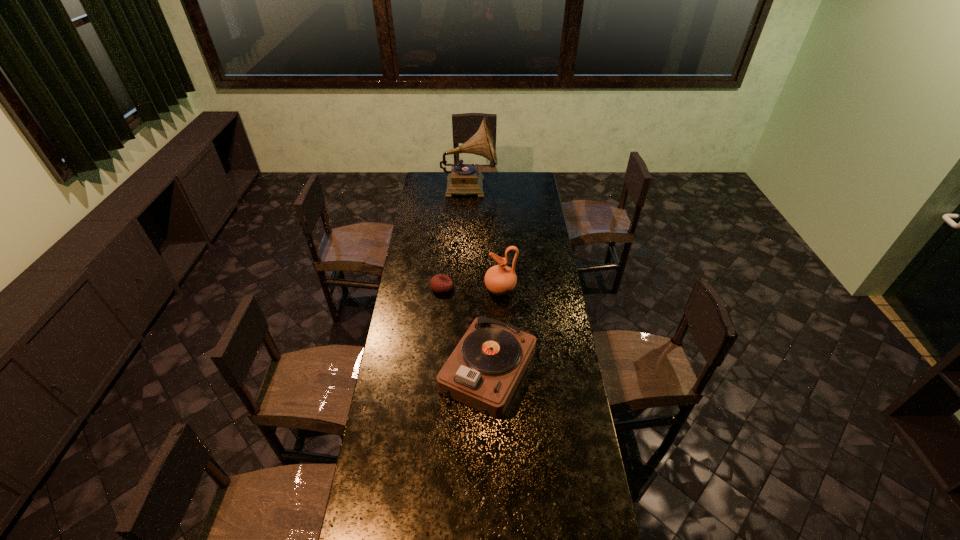
Locate an element on the screen. The image size is (960, 540). vacant space at the far left corner is located at coordinates (438, 173).

Locate an element on the screen. This screenshot has height=540, width=960. vacant region at the far right corner of the desktop is located at coordinates [x=538, y=180].

You are a GUI agent. You are given a task and a screenshot of the screen. Output one action in this format:
    pyautogui.click(x=<x>, y=<y>)
    Task: Click on the empty location between the farthest object and the shorter record player
    The height and width of the screenshot is (540, 960).
    Given the screenshot: What is the action you would take?
    pyautogui.click(x=479, y=279)

This screenshot has width=960, height=540. I want to click on blank region between the taller record player and the beanbag, so click(455, 237).

Locate an element on the screen. This screenshot has width=960, height=540. unoccupied area between the second tallest object and the farthest object is located at coordinates (485, 238).

Identify the location of blank region between the third tallest object and the tallest object. This screenshot has width=960, height=540. (479, 279).

Select which object appears as the second closest to the third tallest object. Please provide its 2D coordinates. Your answer should be formatted as a tuple, i.e. [(x, y)], where the tuple contains the x and y coordinates of a point satisfying the conditions above.

[(440, 283)]

Choose which object is the second nearest neighbor to the farthest object. Please provide its 2D coordinates. Your answer should be formatted as a tuple, i.e. [(x, y)], where the tuple contains the x and y coordinates of a point satisfying the conditions above.

[(440, 283)]

Identify the location of vacant area that satisfies the following two spatial constraints: 1. from the horn of the farthest object; 2. on the right side of the second shortest object. (463, 372).

Locate an element on the screen. The height and width of the screenshot is (540, 960). free space that satisfies the following two spatial constraints: 1. from the horn of the shorter record player; 2. on the left side of the farther record player is located at coordinates (463, 372).